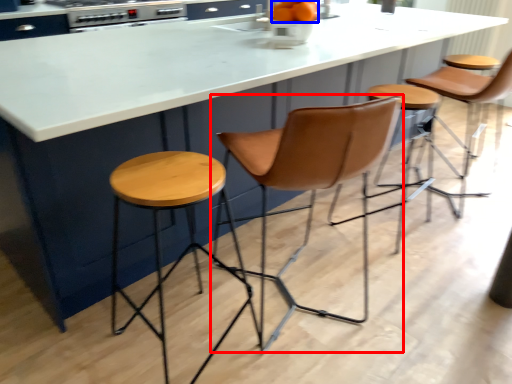
Question: Which object is further to the camera taking this photo, swivel chair (highlighted by a red box) or orange (highlighted by a blue box)?

Choices:
 (A) swivel chair
 (B) orange

Answer: (B)